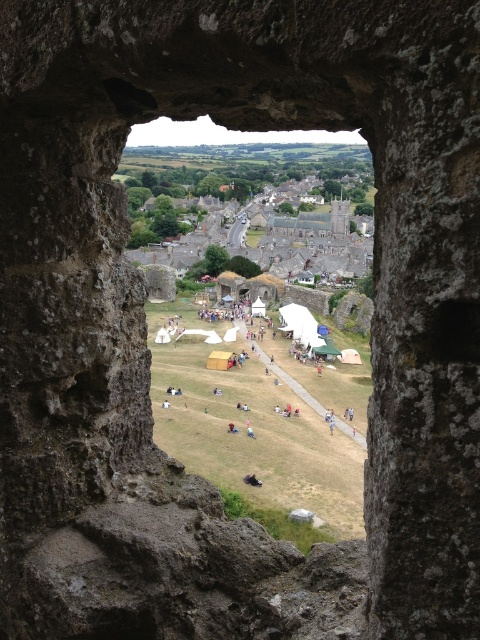
Question: Does white canvas tents at center appear over blue fabric person at center?

Choices:
 (A) yes
 (B) no

Answer: (A)

Question: Does white canvas tents at center have a larger size compared to light blue fabric person at center?

Choices:
 (A) yes
 (B) no

Answer: (A)

Question: Which point is farther from the camera taking this photo?

Choices:
 (A) (247, 429)
 (B) (316, 404)

Answer: (B)

Question: Which object is closer to the camera taking this photo?

Choices:
 (A) white canvas tents at center
 (B) blue fabric person at center

Answer: (B)

Question: Is the position of white canvas tents at center more distant than that of blue fabric person at center?

Choices:
 (A) yes
 (B) no

Answer: (A)

Question: Among these objects, which one is nearest to the camera?

Choices:
 (A) blue fabric person at center
 (B) light blue fabric person at center
 (C) white canvas tents at center

Answer: (A)